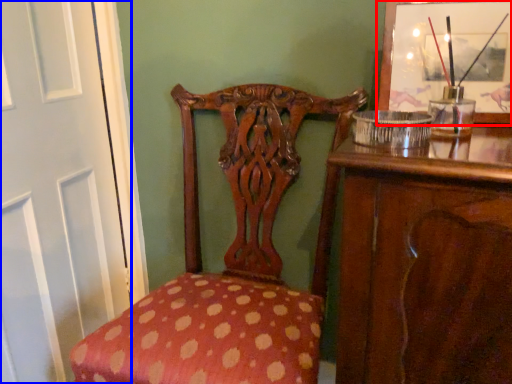
Question: Among these objects, which one is farthest to the camera, picture frame (highlighted by a red box) or screen door (highlighted by a blue box)?

Choices:
 (A) picture frame
 (B) screen door

Answer: (B)